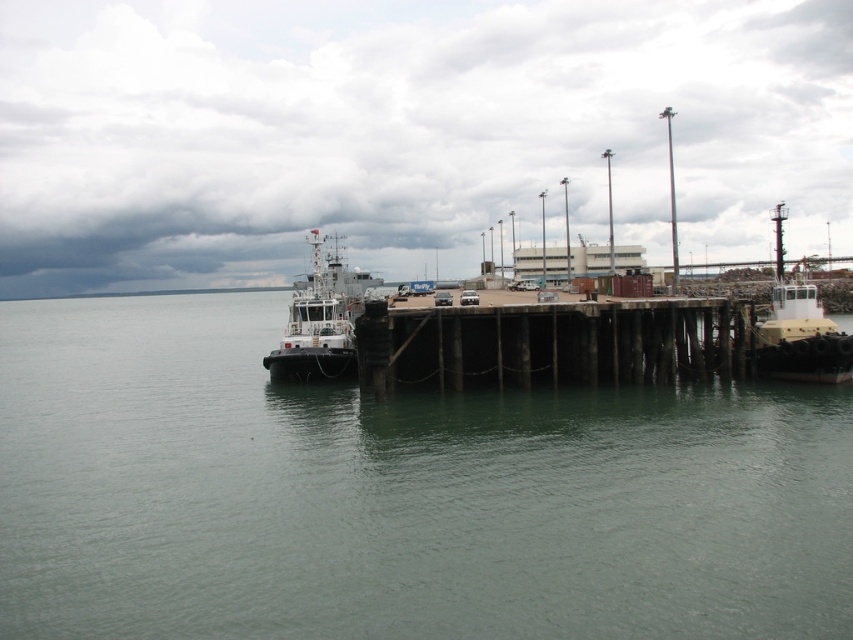
You are a delivery driver who needs to board the white glossy tugboat at left from the brown wooden dock at center. The tugboat has a ramp that can only extend 8 meters. Will you be able to reach the tugboat with the ramp?

The brown wooden dock at center is 8.40 meters away from the white glossy tugboat at left. Since the ramp can only extend 8 meters, it is 0.40 meters too short to reach the tugboat. Therefore, you will not be able to board the tugboat using the ramp.

You are a sailor who needs to navigate a small boat through the greenish water at center and the white glossy tugboat at left. Based on their heights, which one should you avoid hitting your boat on?

The white glossy tugboat at left is taller than the greenish water at center, so you should avoid hitting the white glossy tugboat at left to prevent damage to your boat.